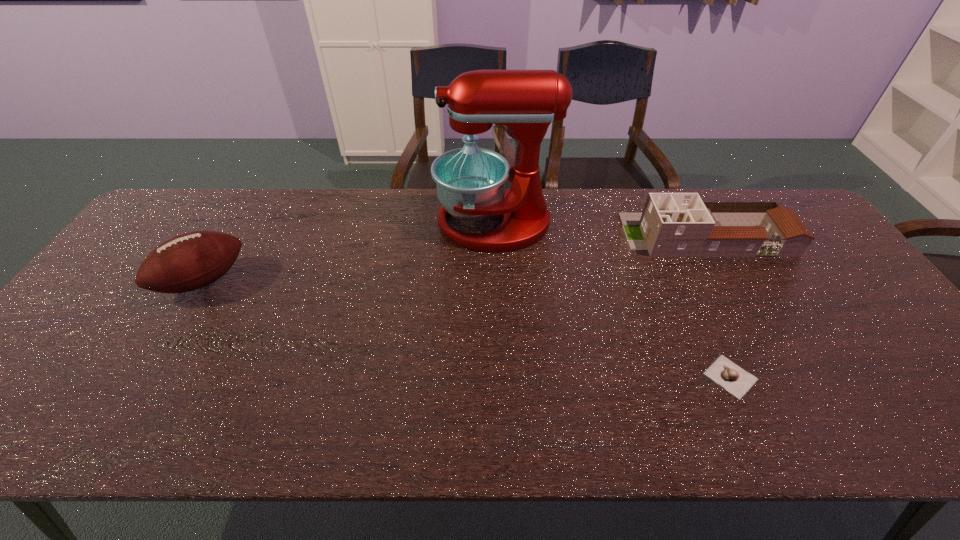
Locate an element on the screen. The width and height of the screenshot is (960, 540). vacant region between the mixer and the football (American) is located at coordinates (348, 252).

Identify the location of free space that is in between the mixer and the third farthest object. The image size is (960, 540). (348, 252).

What are the coordinates of `free space that is in between the dollhouse and the second object from left to right` in the screenshot? It's located at (600, 229).

Identify the location of vacant space in between the dollhouse and the third farthest object. The image size is (960, 540). (454, 258).

The width and height of the screenshot is (960, 540). Find the location of `free space between the dollhouse and the leftmost object`. free space between the dollhouse and the leftmost object is located at coordinates (454, 258).

Identify the location of object that ranks as the second closest to the shortest object. (470, 181).

Point out which object is positioned as the nearest to the tallest object. Please provide its 2D coordinates. Your answer should be formatted as a tuple, i.e. [(x, y)], where the tuple contains the x and y coordinates of a point satisfying the conditions above.

[(672, 224)]

Locate an element on the screen. free space that satisfies the following two spatial constraints: 1. on the front-facing side of the shortest object; 2. on the left side of the second object from left to right is located at coordinates (500, 377).

Identify the location of vacant space that satisfies the following two spatial constraints: 1. on the front side of the shortest object; 2. on the right side of the football (American). Image resolution: width=960 pixels, height=540 pixels. (146, 377).

Where is `vacant area in the image that satisfies the following two spatial constraints: 1. on the front-facing side of the tallest object; 2. on the front side of the leftmost object`? This screenshot has height=540, width=960. vacant area in the image that satisfies the following two spatial constraints: 1. on the front-facing side of the tallest object; 2. on the front side of the leftmost object is located at coordinates (496, 281).